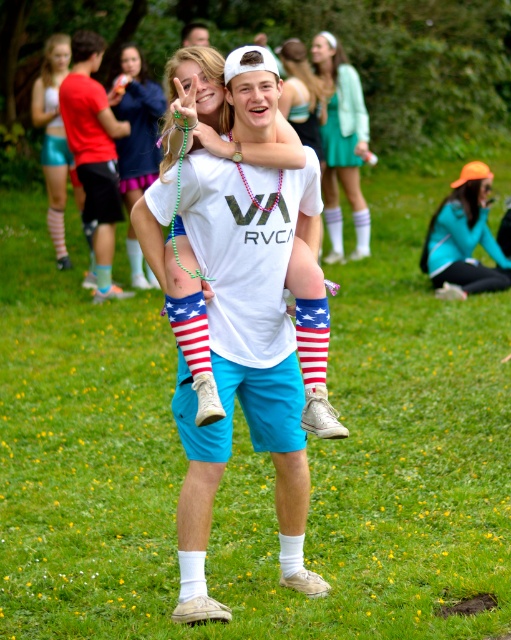
You are standing in the grassy area at the lively outdoor gathering. You notice two points in the scene. The first point is at coordinates point (109,198) and the second is at point (333,230). Which point is closer to you?

Point (109,198) is closer to the viewer than point (333,230).

What object is located at the coordinates point (95,152)?

The point (95,152) corresponds to the matte red shorts at upper left.